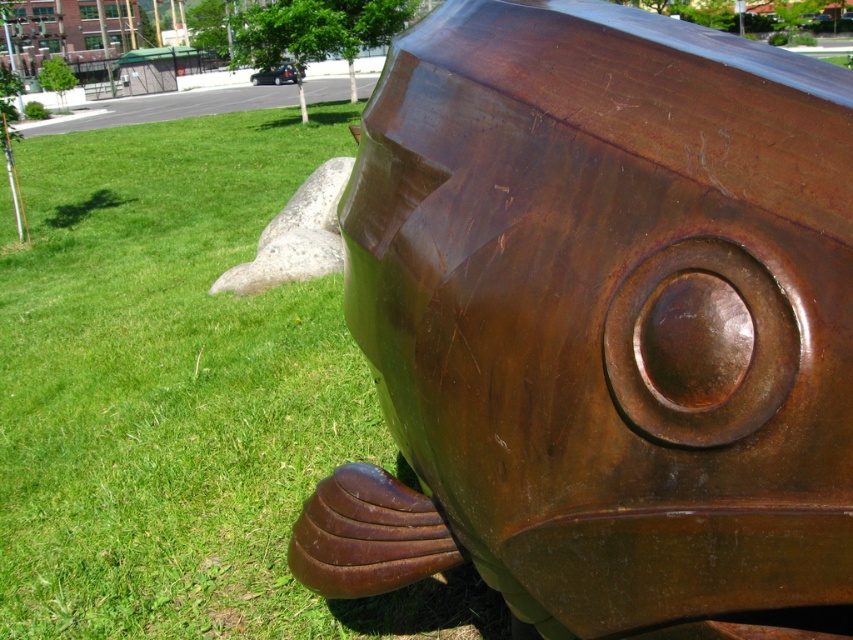
Who is lower down, rusty metal fish at center or green grass at lower left?

rusty metal fish at center

Is point (564, 147) closer to viewer compared to point (210, 582)?

Yes, it is in front of point (210, 582).

Which is in front, point (497, 132) or point (184, 273)?

Positioned in front is point (497, 132).

Identify the location of rusty metal fish at center. (601, 323).